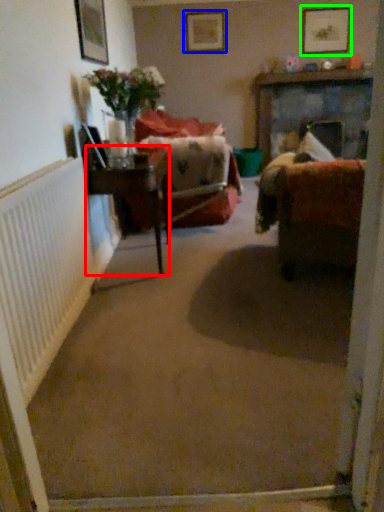
Question: Based on their relative distances, which object is farther from table (highlighted by a red box)? Choose from picture frame (highlighted by a blue box) and picture frame (highlighted by a green box).

Choices:
 (A) picture frame
 (B) picture frame

Answer: (B)